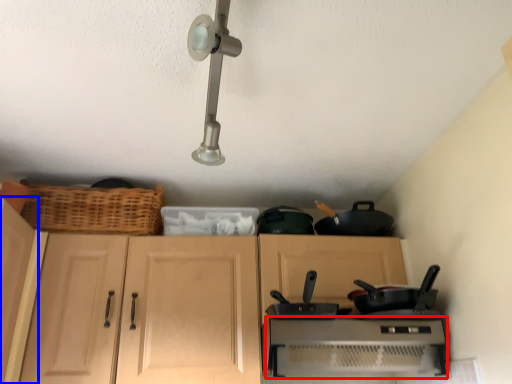
Question: Which object appears farthest to the camera in this image, home appliance (highlighted by a red box) or cabinetry (highlighted by a blue box)?

Choices:
 (A) home appliance
 (B) cabinetry

Answer: (A)